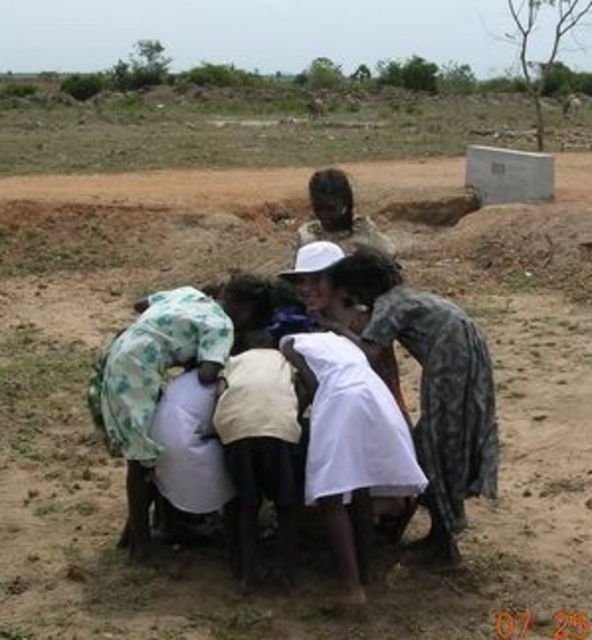
Is point (371, 387) positioned before point (345, 220)?

Yes, point (371, 387) is closer to viewer.

Can you confirm if white cloth at center is thinner than white clothed person at center?

Yes, white cloth at center is thinner than white clothed person at center.

Where is `white cloth at center`? This screenshot has height=640, width=592. white cloth at center is located at coordinates (349, 445).